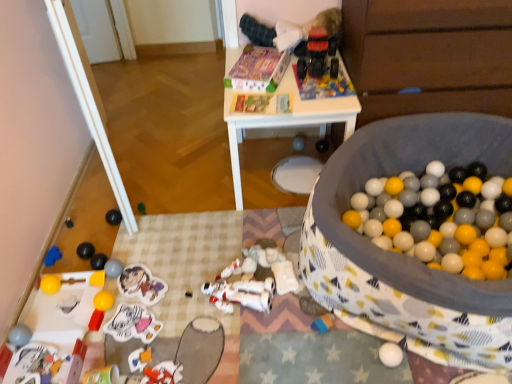
Identify the location of vacant location behind matte white sticker at center, the fourteenth toy when ordered from left to right. (145, 287).